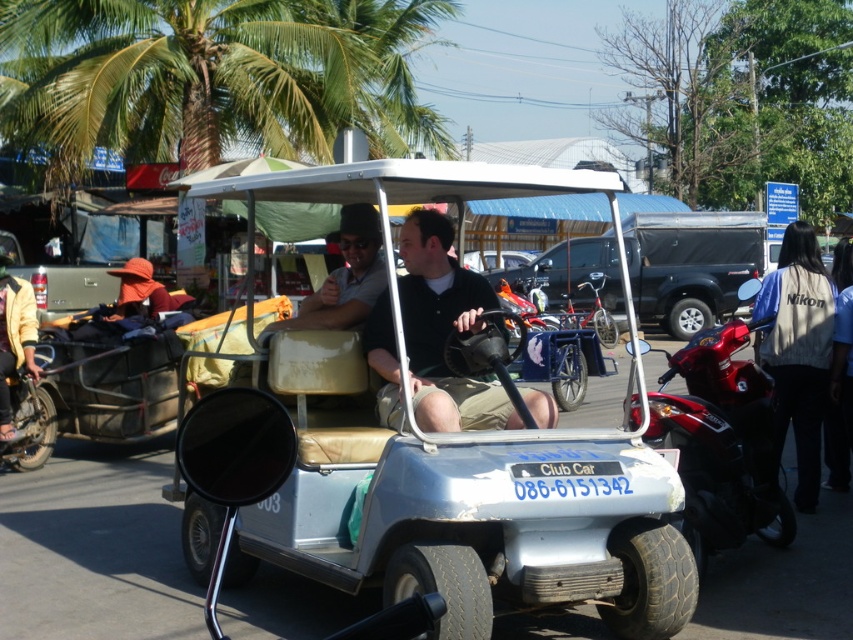
Question: Which of the following is the farthest from the observer?

Choices:
 (A) (4, 362)
 (B) (322, 321)
 (C) (746, 220)

Answer: (C)

Question: Which object appears closest to the camera in this image?

Choices:
 (A) matte black shirt at center
 (B) blue denim jacket at right
 (C) yellow fabric bag at left

Answer: (A)

Question: Can you confirm if yellow fabric bag at left is positioned to the left of brushed metal motorcycle at left?

Choices:
 (A) yes
 (B) no

Answer: (A)

Question: Is black matte truck at center thinner than blue denim jacket at right?

Choices:
 (A) no
 (B) yes

Answer: (A)

Question: Is silver metallic golf cart at center bigger than matte black shirt at center?

Choices:
 (A) no
 (B) yes

Answer: (B)

Question: Which of the following is the farthest from the observer?

Choices:
 (A) black matte shirt at center
 (B) silver metallic golf cart at center
 (C) blue denim jacket at right

Answer: (C)